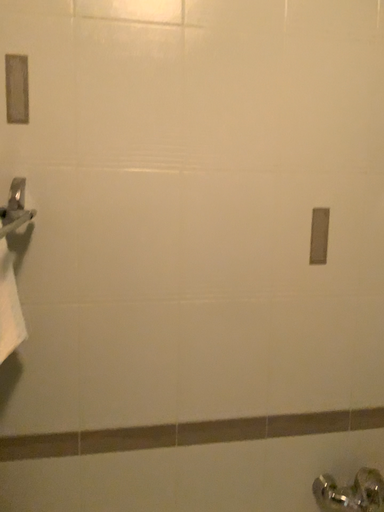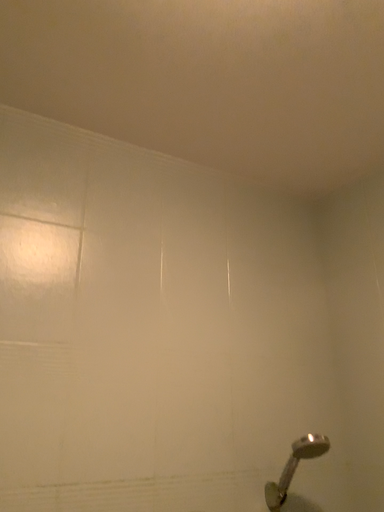
Question: How did the camera likely rotate when shooting the video?

Choices:
 (A) rotated right
 (B) rotated left

Answer: (A)